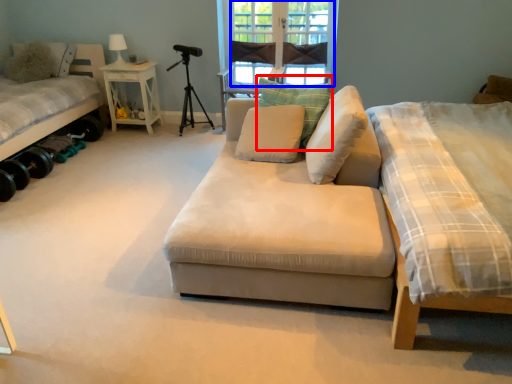
Question: Which object appears closest to the camera in this image, pillow (highlighted by a red box) or window screen (highlighted by a blue box)?

Choices:
 (A) pillow
 (B) window screen

Answer: (A)